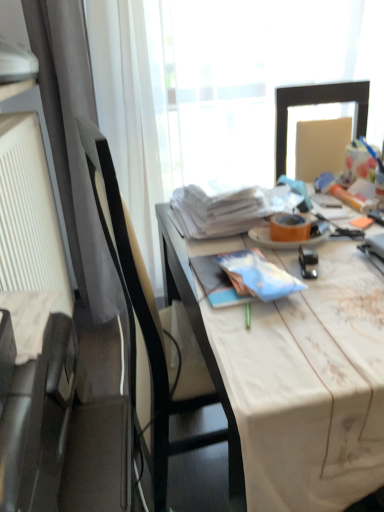
Locate an element on the screen. This screenshot has height=512, width=384. free space behind metallic black stapler at center-right is located at coordinates (306, 244).